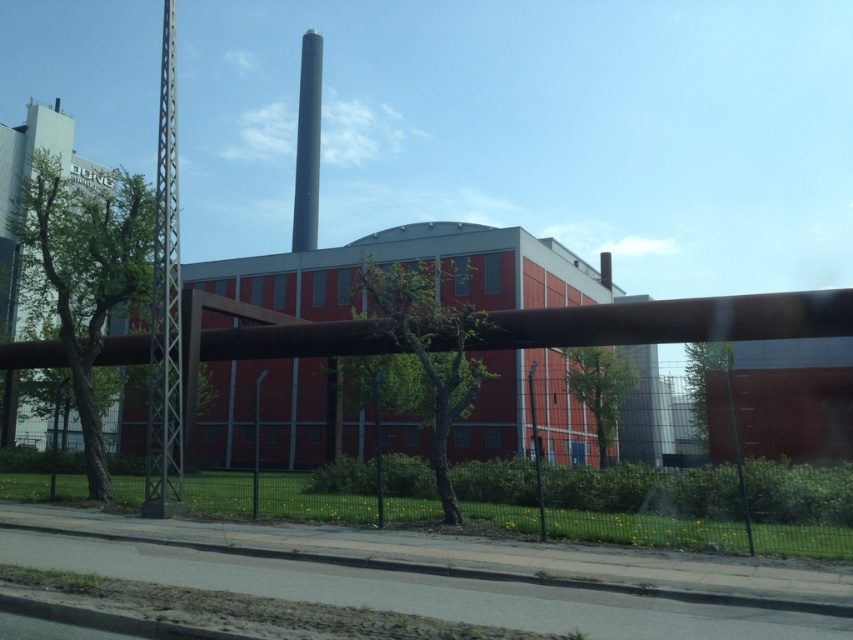
You are standing at the point marked by the coordinates point [646,506]. Based on the scene description, what is the immediate surface you are standing on?

The point [646,506] marks green grass at lower center, so you are standing on green grass.

You are a maintenance worker needing to reach the smooth gray chimney at upper center from your current position on the green grass at lower center. What is the minimum distance you need to walk to reach the chimney?

The minimum distance you need to walk to reach the smooth gray chimney at upper center from the green grass at lower center is 35.49 meters.

You are standing on the sidewalk in front of the industrial building and see two points marked on the ground. The first point is at coordinate point (x=660, y=481), and the second point is at coordinate point (x=316, y=49). Which point is closer to you?

Point (x=660, y=481) is closer to the camera than point (x=316, y=49), so the first point is closer to you.